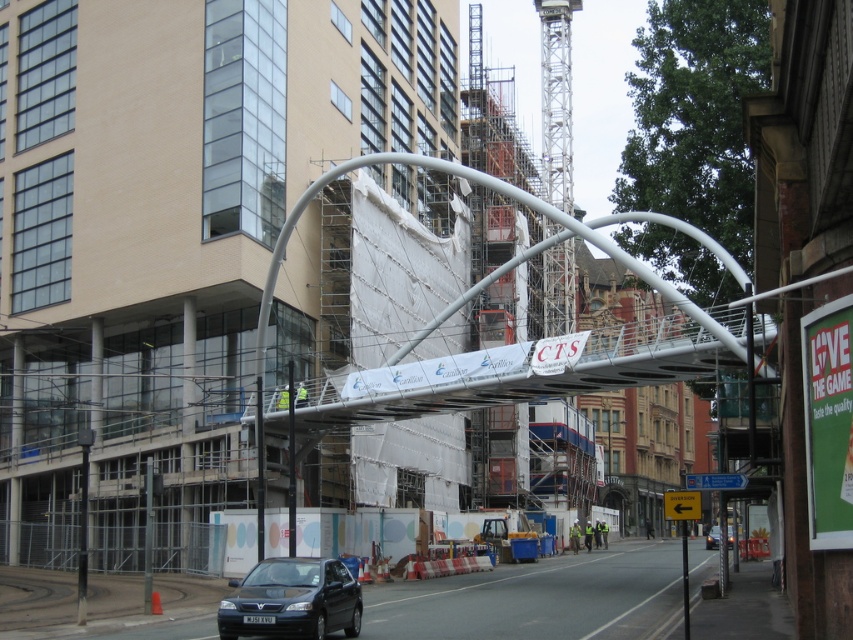
Does matte black car at lower center appear on the right side of black glossy car at center?

In fact, matte black car at lower center is to the left of black glossy car at center.

Who is higher up, matte black car at lower center or black glossy car at center?

matte black car at lower center

Is point (283, 593) positioned in front of point (718, 536)?

Yes, point (283, 593) is closer to viewer.

Where is `matte black car at lower center`? This screenshot has height=640, width=853. matte black car at lower center is located at coordinates (291, 600).